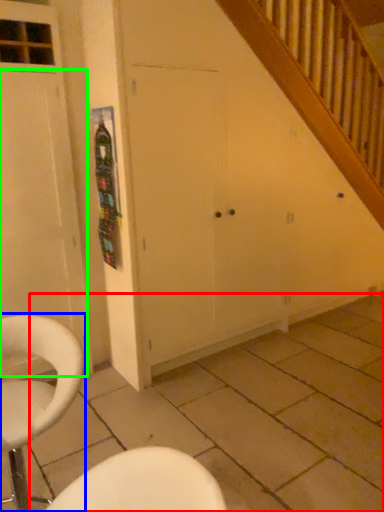
Question: Which object is positioned farthest from tile (highlighted by a red box)? Select from chair (highlighted by a blue box) and door (highlighted by a green box).

Choices:
 (A) chair
 (B) door

Answer: (B)